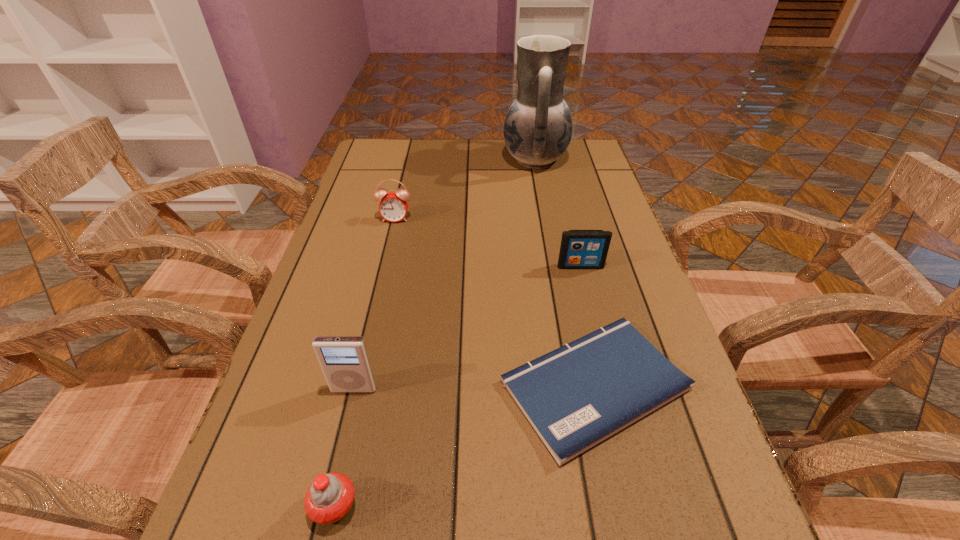
Locate an element on the screen. free area in between the paperback book and the right iPod is located at coordinates click(x=588, y=326).

Locate an element on the screen. The height and width of the screenshot is (540, 960). vacant area that lies between the pitcher and the shortest object is located at coordinates [564, 273].

Locate an element on the screen. The width and height of the screenshot is (960, 540). free space that is in between the right iPod and the paperback book is located at coordinates (588, 326).

You are a GUI agent. You are given a task and a screenshot of the screen. Output one action in this format:
    pyautogui.click(x=<x>, y=<y>)
    Task: Click on the empty location between the shortest object and the alarm clock
    This screenshot has height=540, width=960.
    Given the screenshot: What is the action you would take?
    pyautogui.click(x=495, y=302)

The width and height of the screenshot is (960, 540). In order to click on free space between the nearer iPod and the third farthest object in this screenshot , I will do `click(468, 328)`.

This screenshot has width=960, height=540. Identify the location of vacant space that is in between the farthest object and the fifth shortest object. (444, 274).

You are a GUI agent. You are given a task and a screenshot of the screen. Output one action in this format:
    pyautogui.click(x=<x>, y=<y>)
    Task: Click on the empty space that is in between the taller iPod and the paperback book
    
    Given the screenshot: What is the action you would take?
    pyautogui.click(x=474, y=387)

You are a GUI agent. You are given a task and a screenshot of the screen. Output one action in this format:
    pyautogui.click(x=<x>, y=<y>)
    Task: Click on the free area in between the nearest object and the shortest object
    Image resolution: width=960 pixels, height=540 pixels.
    Given the screenshot: What is the action you would take?
    pyautogui.click(x=465, y=446)

Where is `blank region between the taller iPod and the cupcake`? The width and height of the screenshot is (960, 540). blank region between the taller iPod and the cupcake is located at coordinates (345, 448).

I want to click on the second closest object to the cupcake, so click(576, 396).